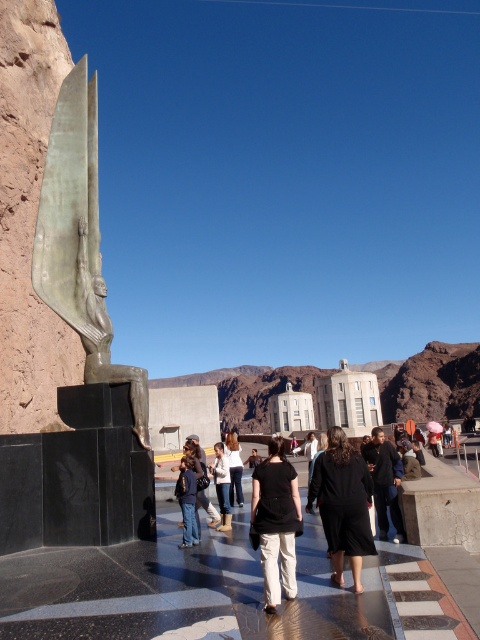
Question: Which point is closer to the camera?

Choices:
 (A) denim jeans at center
 (B) black matte dress at center

Answer: (B)

Question: Is dark brown leather jacket at center further to camera compared to blue jeans at center?

Choices:
 (A) yes
 (B) no

Answer: (B)

Question: Which point is farther to the camera?

Choices:
 (A) blue jeans at center
 (B) black cotton pants at center

Answer: (A)

Question: Can you confirm if denim jacket at center is positioned to the right of denim jeans at center?

Choices:
 (A) yes
 (B) no

Answer: (B)

Question: Which object appears farthest from the camera in this image?

Choices:
 (A) dark brown leather jacket at center
 (B) black cotton pants at center
 (C) black matte dress at center
 (D) blue jeans at center

Answer: (D)

Question: Is dark brown leather jacket at center behind dark blue jeans at center?

Choices:
 (A) yes
 (B) no

Answer: (B)